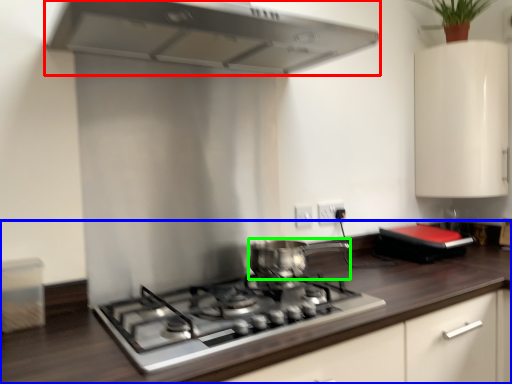
Question: Considering the real-world distances, which object is closest to home appliance (highlighted by a red box)? countertop (highlighted by a blue box) or kitchen appliance (highlighted by a green box).

Choices:
 (A) countertop
 (B) kitchen appliance

Answer: (B)